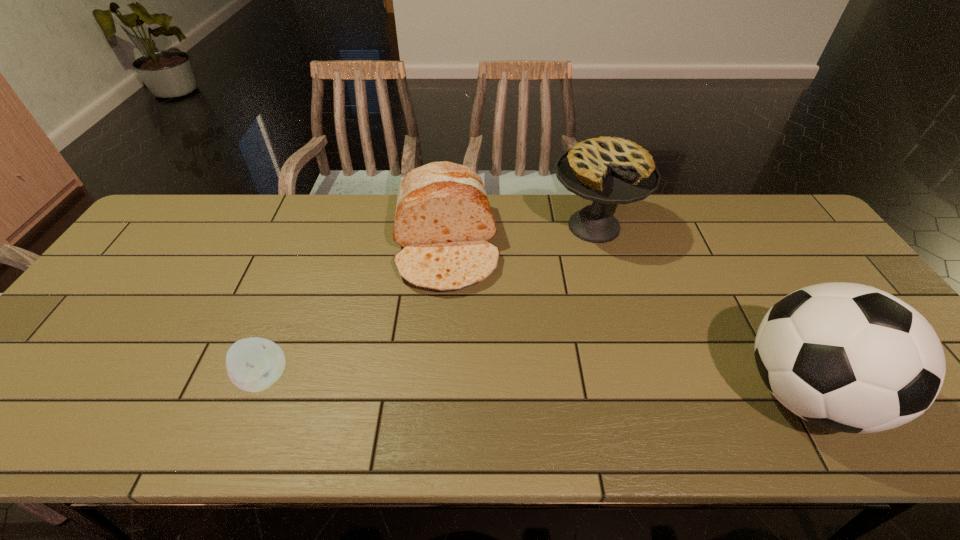
Image resolution: width=960 pixels, height=540 pixels. Identify the location of free space at the far edge. (537, 213).

Image resolution: width=960 pixels, height=540 pixels. Identify the location of vacant space at the near edge. [217, 391].

Where is `vacant space at the left edge of the desktop`? The width and height of the screenshot is (960, 540). vacant space at the left edge of the desktop is located at coordinates pos(127,305).

This screenshot has width=960, height=540. Identify the location of free location at the right edge. (801, 249).

This screenshot has height=540, width=960. In the image, there is a desktop. In order to click on free region at the far left corner in this screenshot , I will do `click(202, 203)`.

This screenshot has height=540, width=960. In order to click on vacant space at the near left corner of the desktop in this screenshot , I will do `click(94, 368)`.

Identify the location of vacant space at the far right corner. Image resolution: width=960 pixels, height=540 pixels. (796, 242).

Locate an element on the screen. free space between the shortest object and the second object from right to left is located at coordinates (429, 302).

Locate an element on the screen. This screenshot has width=960, height=540. free area in between the soccer ball and the bread is located at coordinates point(625,319).

The width and height of the screenshot is (960, 540). I want to click on free spot between the apple and the second object from left to right, so click(355, 312).